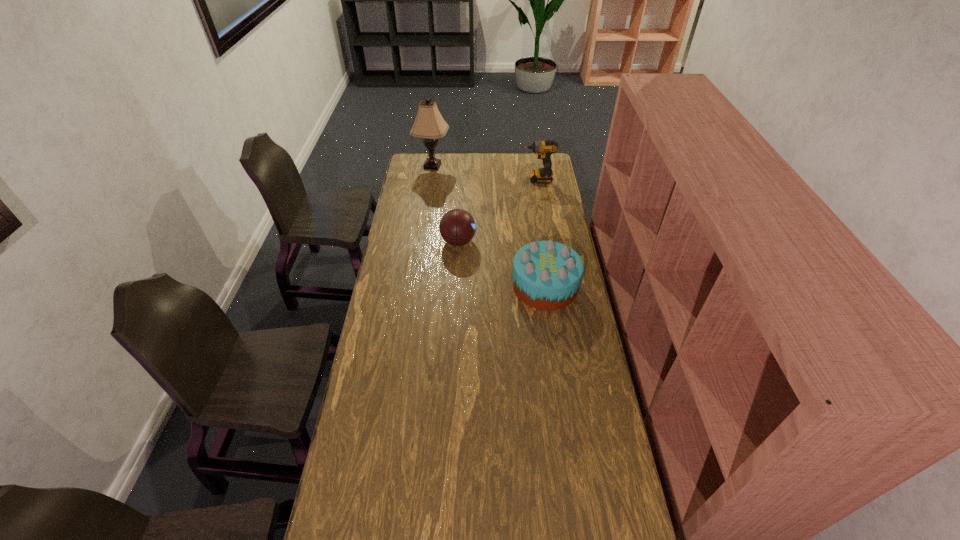
Find the location of a particular element. The height and width of the screenshot is (540, 960). free point between the third shortest object and the farthest object is located at coordinates (485, 173).

Image resolution: width=960 pixels, height=540 pixels. In order to click on object that is the third closest to the second nearest object in this screenshot , I will do `click(429, 124)`.

Locate an element on the screen. The image size is (960, 540). the second closest object to the farthest object is located at coordinates (457, 227).

Locate an element on the screen. blank area in the image that satisfies the following two spatial constraints: 1. on the front side of the lamp; 2. on the left side of the basketball is located at coordinates (421, 241).

This screenshot has width=960, height=540. In order to click on vacant space that satisfies the following two spatial constraints: 1. with the drill bit of the third nearest object facing forward; 2. on the front side of the nearest object in this screenshot , I will do (554, 286).